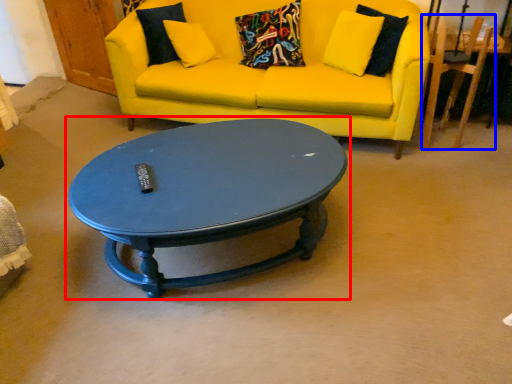
Question: Which point is closer to the camera, coffee table (highlighted by a red box) or armchair (highlighted by a blue box)?

Choices:
 (A) coffee table
 (B) armchair

Answer: (A)